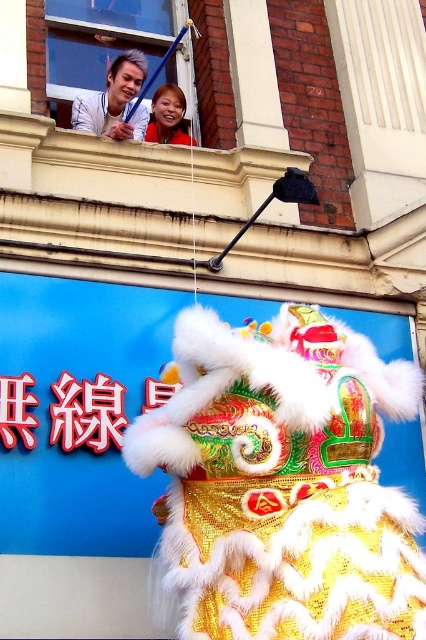
Question: Is clear glass window at upper center thinner than smooth skin face at upper center?

Choices:
 (A) yes
 (B) no

Answer: (B)

Question: Which point appears farthest from the camera in this image?

Choices:
 (A) (95, 100)
 (B) (206, 428)
 (C) (120, 26)

Answer: (C)

Question: Which of the following is the closest to the observer?

Choices:
 (A) (187, 140)
 (B) (333, 576)
 (C) (115, 28)
 (D) (117, 65)

Answer: (B)

Question: Which of the following is the closest to the observer?

Choices:
 (A) (345, 577)
 (B) (48, 4)

Answer: (A)

Question: Observing the image, what is the correct spatial positioning of fuzzy golden lion at center in reference to clear glass window at upper center?

Choices:
 (A) above
 (B) below

Answer: (B)

Question: Is fuzzy golden lion at center smaller than matte white shirt at upper left?

Choices:
 (A) no
 (B) yes

Answer: (A)